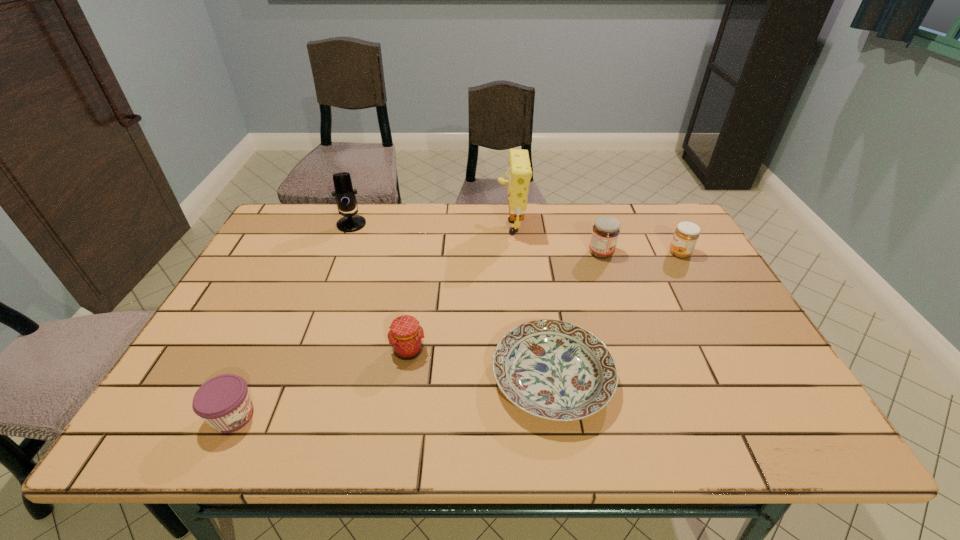
Find the location of a particular element. The image size is (960, 540). vacant area in the image that satisfies the following two spatial constraints: 1. on the front side of the shortest object; 2. on the front label of the nearest jam is located at coordinates (558, 416).